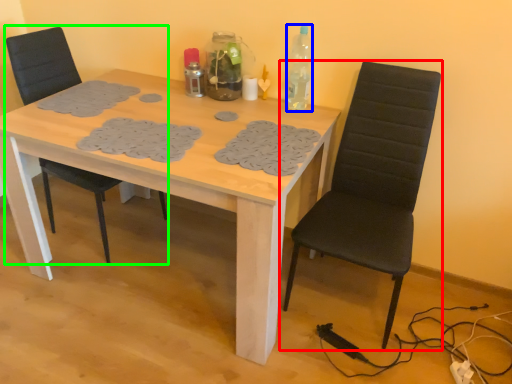
Question: Which object is the farthest from chair (highlighted by a red box)? Choose among these: bottle (highlighted by a blue box) or chair (highlighted by a green box).

Choices:
 (A) bottle
 (B) chair

Answer: (B)